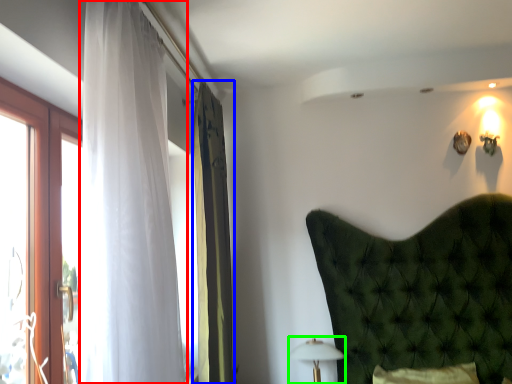
Question: Which object is positioned farthest from curtain (highlighted by a red box)? Select from curtain (highlighted by a blue box) and table lamp (highlighted by a green box).

Choices:
 (A) curtain
 (B) table lamp

Answer: (B)